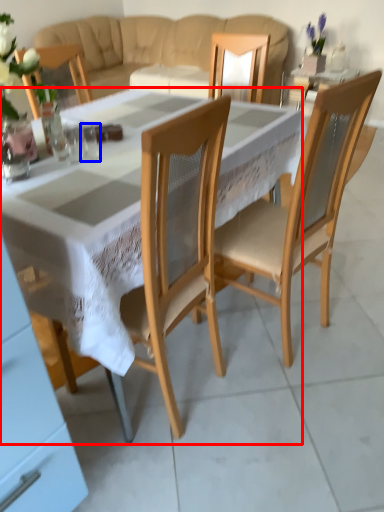
Question: Which object appears farthest to the camera in this image, desk (highlighted by a red box) or tableware (highlighted by a blue box)?

Choices:
 (A) desk
 (B) tableware

Answer: (B)